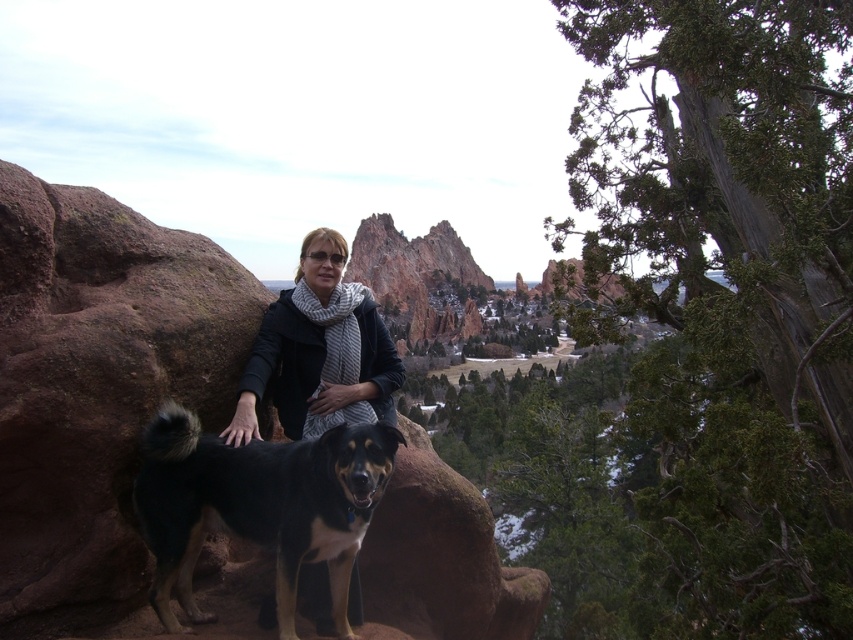
You are standing at the overlook and want to take a photo of the brown rock at center and the black woolen scarf at center. Which object should you focus on first if you want both to be in clear focus?

→ The brown rock at center is closer to the viewer than the black woolen scarf at center, so you should focus on the brown rock at center first to ensure both are in clear focus.

You are standing at the point labeled point (332,442) and want to walk to the point labeled point (347,368). Which direction should you face to walk directly towards your destination?

You should face backward because point (332,442) is in front of point (347,368).

You are standing at the overlook and want to take a photo of both the brown rock at center and the black fur dog at center. Which object should you position closer to the left side of the frame to include both in your shot?

The black fur dog at center should be positioned closer to the left side of the frame because the brown rock at center is to the right of the black fur dog at center.